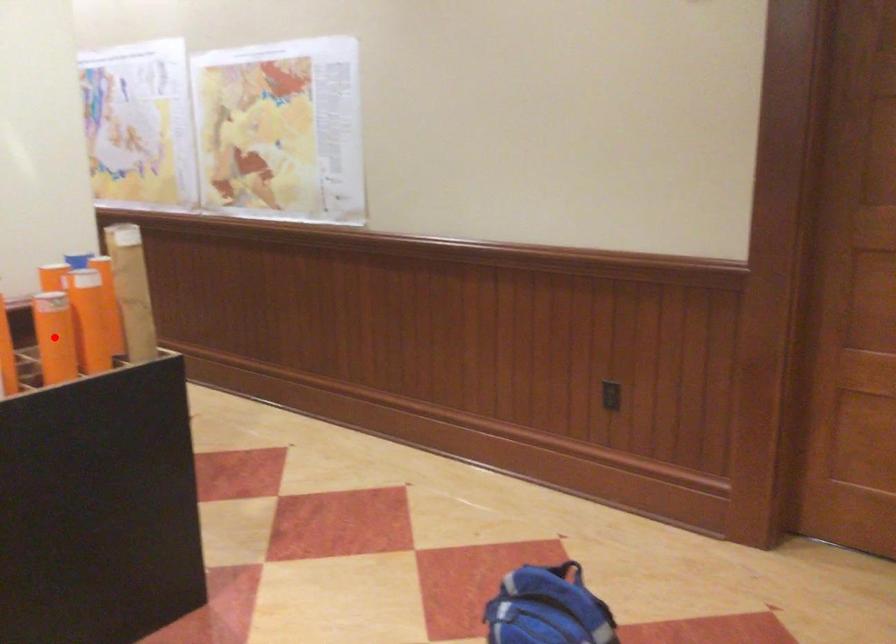
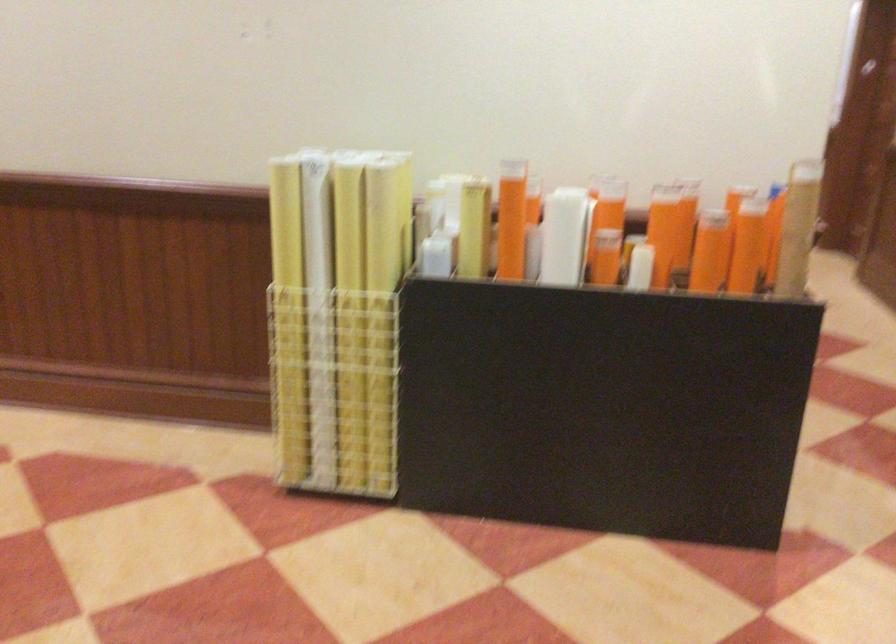
Question: I am providing you with two images of the same scene from different viewpoints. A red point is marked on the first image. Is the red point's position out of view in image 2?

Choices:
 (A) Yes
 (B) No

Answer: (A)